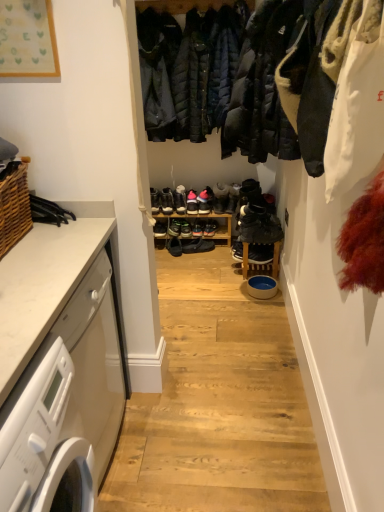
Identify the location of matte black sneaker at center. (220, 197).

Describe the element at coordinates (192, 202) in the screenshot. This screenshot has height=512, width=384. I see `shiny black sneaker at center, marked as the 6th footwear in a right-to-left arrangement` at that location.

How much space does shiny black sneaker at center, the second footwear when ordered from right to left, occupy horizontally?

The width of shiny black sneaker at center, the second footwear when ordered from right to left, is 29.89 centimeters.

Describe the element at coordinates (14, 204) in the screenshot. I see `woven brown basket at left` at that location.

Where is `pink suede sneakers at center, which is counted as the third footwear, starting from the right`? The height and width of the screenshot is (512, 384). pink suede sneakers at center, which is counted as the third footwear, starting from the right is located at coordinates (205, 201).

Which of these two, shiny black sneakers at center, the seventh footwear positioned from the right, or woven brown basket at left, stands taller?

Standing taller between the two is woven brown basket at left.

This screenshot has height=512, width=384. In order to click on the 2nd footwear to the right of the woven brown basket at left, starting your count from the anchor in this screenshot , I will do `click(185, 229)`.

Is shiny black sneakers at center, the seventh footwear positioned from the right, outside of woven brown basket at left?

shiny black sneakers at center, the seventh footwear positioned from the right, lies outside woven brown basket at left's area.

Looking at this image, is black leather shoe at center, the eighth footwear from the right, smaller than shiny black sneakers at center, the fourth footwear in the right-to-left sequence?

No, black leather shoe at center, the eighth footwear from the right, is not smaller than shiny black sneakers at center, the fourth footwear in the right-to-left sequence.

From the image's perspective, does black leather shoe at center, the eighth footwear from the right, appear lower than shiny black sneakers at center, the fifth footwear in the left-to-right sequence?

Actually, black leather shoe at center, the eighth footwear from the right, appears above shiny black sneakers at center, the fifth footwear in the left-to-right sequence, in the image.

How different are the orientations of black leather shoe at center, arranged as the 1th footwear when viewed from the left, and shiny black sneakers at center, the fifth footwear in the left-to-right sequence, in degrees?

black leather shoe at center, arranged as the 1th footwear when viewed from the left, and shiny black sneakers at center, the fifth footwear in the left-to-right sequence, are facing 9 degrees away from each other.

How much distance is there between black leather shoe at center, arranged as the 1th footwear when viewed from the left, and shiny black sneakers at center, the fifth footwear in the left-to-right sequence?

They are 10.69 inches apart.

Is point (186, 227) more distant than point (5, 416)?

Yes, it is.

Which object is positioned more to the right, shiny black sneakers at center, the seventh footwear positioned from the right, or white marble countertop at left?

Positioned to the right is shiny black sneakers at center, the seventh footwear positioned from the right.

Is shiny black sneakers at center, the 2th footwear when ordered from left to right, beside white marble countertop at left?

There is a gap between shiny black sneakers at center, the 2th footwear when ordered from left to right, and white marble countertop at left.

Locate an element on the screen. countertop below the shiny black sneakers at center, the 2th footwear when ordered from left to right (from the image's perspective) is located at coordinates (69, 383).

Does black leather shoe at center, the eighth footwear from the right, have a greater height compared to black suede shoes at center, the 8th footwear viewed from the left?

Yes.

The height and width of the screenshot is (512, 384). In order to click on the 7th footwear counting from the left side of the black suede shoes at center, the 8th footwear viewed from the left in this screenshot , I will do `click(180, 199)`.

Considering the relative positions of black leather shoe at center, arranged as the 1th footwear when viewed from the left, and black suede shoes at center, the 8th footwear viewed from the left, in the image provided, is black leather shoe at center, arranged as the 1th footwear when viewed from the left, behind black suede shoes at center, the 8th footwear viewed from the left,?

Yes, it is behind black suede shoes at center, the 8th footwear viewed from the left.

From the image's perspective, is black leather shoe at center, the eighth footwear from the right, on black suede shoes at center, the 1th footwear viewed from the right?

Yes, from the image's perspective, black leather shoe at center, the eighth footwear from the right, is over black suede shoes at center, the 1th footwear viewed from the right.

Considering the positions of points (60, 451) and (176, 187), is point (60, 451) closer to camera compared to point (176, 187)?

Yes, it is in front of point (176, 187).

Are white glossy washing machine at left and black leather shoe at center, the eighth footwear from the right, located far from each other?

Indeed, white glossy washing machine at left is not near black leather shoe at center, the eighth footwear from the right.

Image resolution: width=384 pixels, height=512 pixels. What are the coordinates of `washing machine above the black leather shoe at center, arranged as the 1th footwear when viewed from the left (from a real-world perspective)` in the screenshot? It's located at (45, 445).

Visually, is shiny black sneaker at center, which appears as the 7th footwear when viewed from the left, positioned to the left or to the right of shiny black sneakers at center, the fifth footwear in the left-to-right sequence?

Clearly, shiny black sneaker at center, which appears as the 7th footwear when viewed from the left, is on the right of shiny black sneakers at center, the fifth footwear in the left-to-right sequence, in the image.

From the image's perspective, between shiny black sneaker at center, which appears as the 7th footwear when viewed from the left, and shiny black sneakers at center, the fifth footwear in the left-to-right sequence, who is located below?

shiny black sneakers at center, the fifth footwear in the left-to-right sequence.

From the picture: Would you say shiny black sneaker at center, the second footwear when ordered from right to left, contains shiny black sneakers at center, the fourth footwear in the right-to-left sequence?

No, shiny black sneakers at center, the fourth footwear in the right-to-left sequence, is not surrounded by shiny black sneaker at center, the second footwear when ordered from right to left.

Is shiny black sneaker at center, the second footwear when ordered from right to left, looking in the opposite direction of shiny black sneakers at center, the fourth footwear in the right-to-left sequence?

No, shiny black sneaker at center, the second footwear when ordered from right to left, is not facing the opposite direction of shiny black sneakers at center, the fourth footwear in the right-to-left sequence.

Considering the sizes of objects white glossy washing machine at left and black suede shoes at center, the 8th footwear viewed from the left, in the image provided, who is wider, white glossy washing machine at left or black suede shoes at center, the 8th footwear viewed from the left,?

white glossy washing machine at left is wider.

Is the depth of white glossy washing machine at left greater than that of black suede shoes at center, the 8th footwear viewed from the left?

No, white glossy washing machine at left is closer to the camera.

Is there a large distance between white glossy washing machine at left and black suede shoes at center, the 8th footwear viewed from the left?

That's right, there is a large distance between white glossy washing machine at left and black suede shoes at center, the 8th footwear viewed from the left.

Considering the relative sizes of white glossy washing machine at left and black suede shoes at center, the 8th footwear viewed from the left, in the image provided, is white glossy washing machine at left shorter than black suede shoes at center, the 8th footwear viewed from the left,?

No.

From the image's perspective, count 1st footwears upward from the woven brown basket at left and point to it. Please provide its 2D coordinates.

[(185, 229)]

Locate an element on the screen. This screenshot has height=512, width=384. the 5th footwear above the shiny black sneakers at center, the fourth footwear in the right-to-left sequence (from a real-world perspective) is located at coordinates (180, 199).

In the scene shown: Based on their spatial positions, is white marble countertop at left or white glossy washing machine at left further from matte black sneaker at center?

white glossy washing machine at left is further to matte black sneaker at center.

When comparing their distances from pink suede sneakers at center, which is counted as the third footwear, starting from the right, does shiny black sneakers at center, the fourth footwear in the right-to-left sequence, or shiny black sneakers at center, the seventh footwear positioned from the right, seem closer?

shiny black sneakers at center, the fourth footwear in the right-to-left sequence.

Estimate the real-world distances between objects in this image. Which object is closer to white glossy washing machine at left, shiny black sneaker at center, marked as the 6th footwear in a right-to-left arrangement, or shiny black sneakers at center, the fourth footwear in the right-to-left sequence?

Among the two, shiny black sneaker at center, marked as the 6th footwear in a right-to-left arrangement, is located nearer to white glossy washing machine at left.

Estimate the real-world distances between objects in this image. Which object is further from black suede shoes at center, the 8th footwear viewed from the left, shiny black sneakers at center, the 2th footwear when ordered from left to right, or shiny black sneakers at center, the fifth footwear in the left-to-right sequence?

The object further to black suede shoes at center, the 8th footwear viewed from the left, is shiny black sneakers at center, the 2th footwear when ordered from left to right.

Estimate the real-world distances between objects in this image. Which object is further from shiny black sneaker at center, the second footwear when ordered from right to left, shiny black sneakers at center, the 2th footwear when ordered from left to right, or pink suede sneakers at center, the 6th footwear viewed from the left?

pink suede sneakers at center, the 6th footwear viewed from the left, is further to shiny black sneaker at center, the second footwear when ordered from right to left.

Based on their spatial positions, is shiny black sneakers at center, the seventh footwear positioned from the right, or matte black sneaker at center closer to white glossy washing machine at left?

Based on the image, shiny black sneakers at center, the seventh footwear positioned from the right, appears to be nearer to white glossy washing machine at left.

When comparing their distances from shiny black sneakers at center, the seventh footwear positioned from the right, does white glossy washing machine at left or black leather shoe at center, arranged as the 1th footwear when viewed from the left, seem further?

Based on the image, white glossy washing machine at left appears to be further to shiny black sneakers at center, the seventh footwear positioned from the right.

When comparing their distances from black suede shoes at center, which is the 4th footwear from left to right, does white marble countertop at left or woven brown basket at left seem closer?

white marble countertop at left.

Where is `footwear positioned between white glossy washing machine at left and black leather shoe at center, arranged as the 1th footwear when viewed from the left, from near to far`? Image resolution: width=384 pixels, height=512 pixels. footwear positioned between white glossy washing machine at left and black leather shoe at center, arranged as the 1th footwear when viewed from the left, from near to far is located at coordinates (260, 253).

Where is `basket between white marble countertop at left and shiny black sneaker at center, the second footwear when ordered from right to left, along the z-axis`? This screenshot has height=512, width=384. basket between white marble countertop at left and shiny black sneaker at center, the second footwear when ordered from right to left, along the z-axis is located at coordinates (14, 204).

Find the location of a particular element. countertop that lies between woven brown basket at left and white glossy washing machine at left from top to bottom is located at coordinates (69, 383).

The height and width of the screenshot is (512, 384). I want to click on shoe between white marble countertop at left and shiny black sneakers at center, the fourth footwear in the right-to-left sequence, from front to back, so click(220, 197).